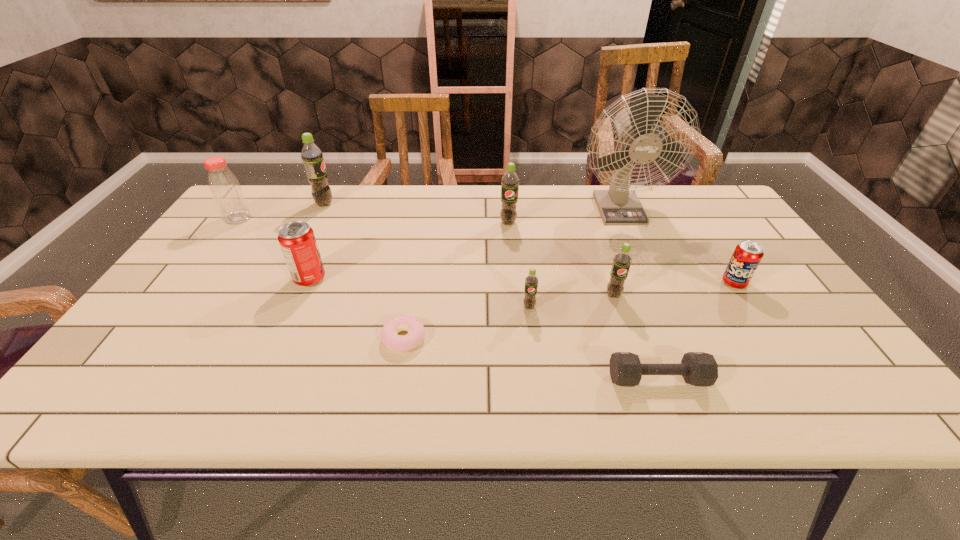
You are a GUI agent. You are given a task and a screenshot of the screen. Output one action in this format:
    pyautogui.click(x=<x>, y=<y>)
    Task: Click on the gray fan
    
    Given the screenshot: What is the action you would take?
    pyautogui.click(x=619, y=205)

The height and width of the screenshot is (540, 960). In order to click on fan in this screenshot , I will do pyautogui.click(x=619, y=205).

Image resolution: width=960 pixels, height=540 pixels. In order to click on the second tallest object in this screenshot , I will do `click(311, 155)`.

Image resolution: width=960 pixels, height=540 pixels. In order to click on the leftmost green soda in this screenshot , I will do `click(311, 155)`.

Image resolution: width=960 pixels, height=540 pixels. Find the location of `the third nearest green soda`. the third nearest green soda is located at coordinates (510, 182).

Identify the location of the second tallest soda. The height and width of the screenshot is (540, 960). (510, 182).

This screenshot has width=960, height=540. I want to click on red bottle, so click(226, 191).

Where is `bottle`? The width and height of the screenshot is (960, 540). bottle is located at coordinates (226, 191).

You are a GUI agent. You are given a task and a screenshot of the screen. Output one action in this format:
    pyautogui.click(x=<x>, y=<y>)
    Task: Click on the left red soda can
    This screenshot has width=960, height=540.
    Given the screenshot: What is the action you would take?
    pyautogui.click(x=297, y=240)

Identify the location of the second nearest green soda. Image resolution: width=960 pixels, height=540 pixels. (622, 260).